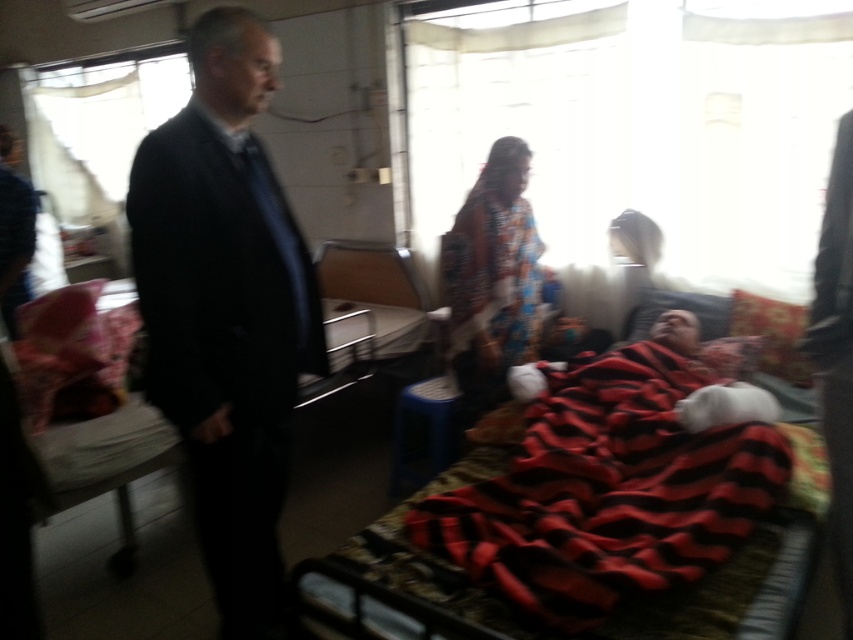
Question: Can you confirm if black suit at left is smaller than red striped fabric at lower right?

Choices:
 (A) no
 (B) yes

Answer: (B)

Question: Estimate the real-world distances between objects in this image. Which object is closer to the black suit at left?

Choices:
 (A) red striped fabric at lower right
 (B) printed fabric dress at center

Answer: (A)

Question: Among these points, which one is farthest from the camera?

Choices:
 (A) (422, 532)
 (B) (250, 140)
 (C) (468, 230)

Answer: (C)

Question: Where is black suit at left located in relation to printed fabric dress at center in the image?

Choices:
 (A) below
 (B) above

Answer: (A)

Question: Can you confirm if black suit at left is positioned below red striped fabric at lower right?

Choices:
 (A) no
 (B) yes

Answer: (A)

Question: Which of the following is the farthest from the observer?

Choices:
 (A) printed fabric dress at center
 (B) red striped fabric at lower right
 (C) black suit at left

Answer: (A)